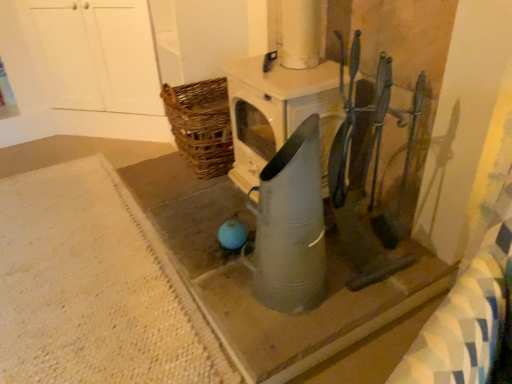
Describe the element at coordinates (93, 287) in the screenshot. I see `white textured rug at lower left, arranged as the second concrete when viewed from the right` at that location.

Where is `metallic gray watering can at center, the 1th concrete viewed from the right`? This screenshot has width=512, height=384. metallic gray watering can at center, the 1th concrete viewed from the right is located at coordinates (251, 279).

From a real-world perspective, is white textured rug at lower left, which is counted as the first concrete, starting from the left, over metallic gray watering can at center, the 1th concrete viewed from the right?

No, from a real-world perspective, white textured rug at lower left, which is counted as the first concrete, starting from the left, is not over metallic gray watering can at center, the 1th concrete viewed from the right

I want to click on concrete in front of the metallic gray watering can at center, the 1th concrete viewed from the right, so click(93, 287).

Considering the sizes of objects white textured rug at lower left, which is counted as the first concrete, starting from the left, and metallic gray watering can at center, the 1th concrete viewed from the right, in the image provided, who is smaller, white textured rug at lower left, which is counted as the first concrete, starting from the left, or metallic gray watering can at center, the 1th concrete viewed from the right,?

white textured rug at lower left, which is counted as the first concrete, starting from the left.

Considering the relative sizes of white textured rug at lower left, which is counted as the first concrete, starting from the left, and metallic gray watering can at center, which is counted as the 2th concrete, starting from the left, in the image provided, is white textured rug at lower left, which is counted as the first concrete, starting from the left, taller than metallic gray watering can at center, which is counted as the 2th concrete, starting from the left,?

Incorrect, the height of white textured rug at lower left, which is counted as the first concrete, starting from the left, is not larger of that of metallic gray watering can at center, which is counted as the 2th concrete, starting from the left.

Which of these two, white textured rug at lower left, arranged as the second concrete when viewed from the right, or metallic gray watering can at center, stands shorter?

white textured rug at lower left, arranged as the second concrete when viewed from the right.

Could you tell me if white textured rug at lower left, arranged as the second concrete when viewed from the right, is turned towards metallic gray watering can at center?

No.

Does point (91, 365) appear closer or farther from the camera than point (320, 174)?

Point (91, 365) is farther from the camera than point (320, 174).

Which object is wider, white textured rug at lower left, arranged as the second concrete when viewed from the right, or metallic gray watering can at center?

Wider between the two is white textured rug at lower left, arranged as the second concrete when viewed from the right.

Considering the relative sizes of metallic gray watering can at center and white textured rug at lower left, which is counted as the first concrete, starting from the left, in the image provided, is metallic gray watering can at center bigger than white textured rug at lower left, which is counted as the first concrete, starting from the left,?

Incorrect, metallic gray watering can at center is not larger than white textured rug at lower left, which is counted as the first concrete, starting from the left.

Is metallic gray watering can at center oriented towards white textured rug at lower left, arranged as the second concrete when viewed from the right?

No, metallic gray watering can at center is not aimed at white textured rug at lower left, arranged as the second concrete when viewed from the right.

Where is `appliance positioned vertically above the white textured rug at lower left, arranged as the second concrete when viewed from the right (from a real-world perspective)`? This screenshot has width=512, height=384. appliance positioned vertically above the white textured rug at lower left, arranged as the second concrete when viewed from the right (from a real-world perspective) is located at coordinates (291, 225).

Is point (278, 207) closer or farther from the camera than point (132, 239)?

Point (278, 207).

Considering the sizes of objects metallic gray watering can at center, the 1th concrete viewed from the right, and metallic gray watering can at center in the image provided, who is smaller, metallic gray watering can at center, the 1th concrete viewed from the right, or metallic gray watering can at center?

Smaller between the two is metallic gray watering can at center.

In terms of width, does metallic gray watering can at center, the 1th concrete viewed from the right, look wider or thinner when compared to metallic gray watering can at center?

Considering their sizes, metallic gray watering can at center, the 1th concrete viewed from the right, looks broader than metallic gray watering can at center.

I want to click on concrete that is the 1st one when counting leftward from the metallic gray watering can at center, so click(251, 279).

Considering the points (337, 352) and (313, 198), which point is in front, point (337, 352) or point (313, 198)?

The point (313, 198) is more forward.

From a real-world perspective, is metallic gray watering can at center, the 1th concrete viewed from the right, over white textured rug at lower left, arranged as the second concrete when viewed from the right?

Correct, in the physical world, metallic gray watering can at center, the 1th concrete viewed from the right, is higher than white textured rug at lower left, arranged as the second concrete when viewed from the right.

Who is bigger, metallic gray watering can at center, the 1th concrete viewed from the right, or white textured rug at lower left, which is counted as the first concrete, starting from the left?

Bigger between the two is metallic gray watering can at center, the 1th concrete viewed from the right.

Are metallic gray watering can at center, which is counted as the 2th concrete, starting from the left, and white textured rug at lower left, arranged as the second concrete when viewed from the right, making contact?

There is a gap between metallic gray watering can at center, which is counted as the 2th concrete, starting from the left, and white textured rug at lower left, arranged as the second concrete when viewed from the right.

Is point (290, 322) behind point (89, 330)?

No, it is not.

Is metallic gray watering can at center not within metallic gray watering can at center, the 1th concrete viewed from the right?

metallic gray watering can at center lies outside metallic gray watering can at center, the 1th concrete viewed from the right,'s area.

Considering the positions of objects metallic gray watering can at center and metallic gray watering can at center, the 1th concrete viewed from the right, in the image provided, who is more to the left, metallic gray watering can at center or metallic gray watering can at center, the 1th concrete viewed from the right,?

From the viewer's perspective, metallic gray watering can at center, the 1th concrete viewed from the right, appears more on the left side.

Is metallic gray watering can at center taller than metallic gray watering can at center, which is counted as the 2th concrete, starting from the left?

Correct, metallic gray watering can at center is much taller as metallic gray watering can at center, which is counted as the 2th concrete, starting from the left.

Consider the image. How much distance is there between metallic gray watering can at center and metallic gray watering can at center, the 1th concrete viewed from the right?

The distance of metallic gray watering can at center from metallic gray watering can at center, the 1th concrete viewed from the right, is 12.80 inches.

Find the location of a particular element. The height and width of the screenshot is (384, 512). concrete beneath the metallic gray watering can at center, the 1th concrete viewed from the right (from a real-world perspective) is located at coordinates (93, 287).

Locate an element on the screen. This screenshot has width=512, height=384. concrete that is the 2nd one when counting downward from the metallic gray watering can at center (from the image's perspective) is located at coordinates (93, 287).

Looking at the image, which one is located closer to metallic gray watering can at center, white textured rug at lower left, which is counted as the first concrete, starting from the left, or metallic gray watering can at center, the 1th concrete viewed from the right?

metallic gray watering can at center, the 1th concrete viewed from the right, is positioned closer to the anchor metallic gray watering can at center.

Estimate the real-world distances between objects in this image. Which object is further from metallic gray watering can at center, the 1th concrete viewed from the right, white textured rug at lower left, arranged as the second concrete when viewed from the right, or metallic gray watering can at center?

The object further to metallic gray watering can at center, the 1th concrete viewed from the right, is metallic gray watering can at center.

Which object lies further to the anchor point white textured rug at lower left, which is counted as the first concrete, starting from the left, metallic gray watering can at center, which is counted as the 2th concrete, starting from the left, or metallic gray watering can at center?

The object further to white textured rug at lower left, which is counted as the first concrete, starting from the left, is metallic gray watering can at center.

From the image, which object appears to be farther from white textured rug at lower left, which is counted as the first concrete, starting from the left, metallic gray watering can at center or metallic gray watering can at center, which is counted as the 2th concrete, starting from the left?

metallic gray watering can at center is positioned further to the anchor white textured rug at lower left, which is counted as the first concrete, starting from the left.

Looking at the image, which one is located further to metallic gray watering can at center, the 1th concrete viewed from the right, metallic gray watering can at center or white textured rug at lower left, arranged as the second concrete when viewed from the right?

metallic gray watering can at center.

Estimate the real-world distances between objects in this image. Which object is closer to metallic gray watering can at center, metallic gray watering can at center, which is counted as the 2th concrete, starting from the left, or white textured rug at lower left, arranged as the second concrete when viewed from the right?

metallic gray watering can at center, which is counted as the 2th concrete, starting from the left, is closer to metallic gray watering can at center.

What are the coordinates of `concrete between white textured rug at lower left, which is counted as the first concrete, starting from the left, and metallic gray watering can at center, in the horizontal direction` in the screenshot? It's located at [251, 279].